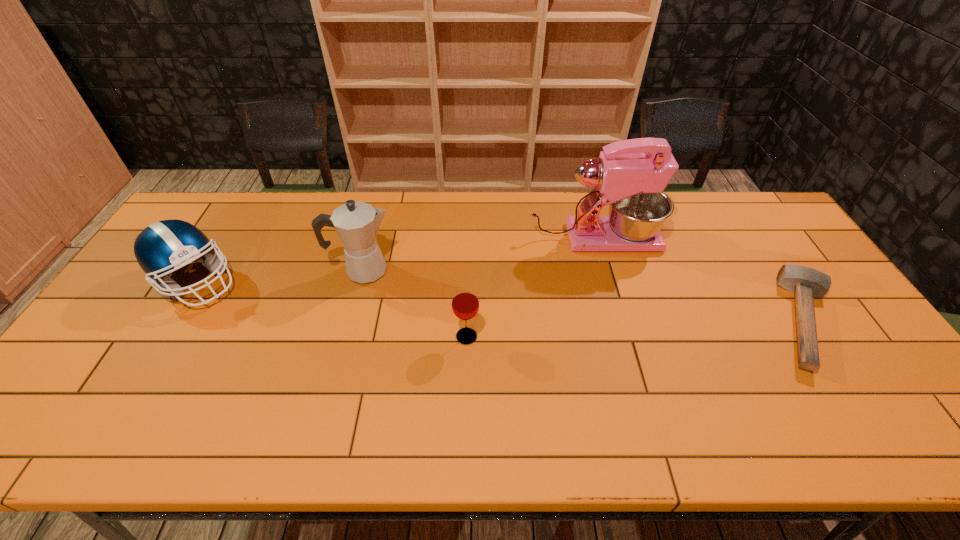
At what (x,y) coordinates should I click in order to perform the action: click on mixer. Please return your answer as a coordinate pair (x, y). Looking at the image, I should click on (630, 175).

You are a GUI agent. You are given a task and a screenshot of the screen. Output one action in this format:
    pyautogui.click(x=<x>, y=<y>)
    Task: Click on the fourth object from left to right
    The image size is (960, 540).
    Given the screenshot: What is the action you would take?
    pyautogui.click(x=630, y=175)

Image resolution: width=960 pixels, height=540 pixels. In order to click on coffeepot in this screenshot , I will do `click(356, 223)`.

The height and width of the screenshot is (540, 960). In order to click on the second tallest object in this screenshot , I will do `click(356, 223)`.

The width and height of the screenshot is (960, 540). What are the coordinates of `football helmet` in the screenshot? It's located at (163, 247).

Where is `glass`? The height and width of the screenshot is (540, 960). glass is located at coordinates (465, 304).

Find the location of a particular element. the shortest object is located at coordinates (806, 283).

Where is `mallet`? The image size is (960, 540). mallet is located at coordinates (806, 283).

In order to click on vacant region located on the face of the fourth object from left to right in this screenshot , I will do click(767, 238).

The height and width of the screenshot is (540, 960). I want to click on vacant space located on the left of the second object from left to right, so click(x=199, y=271).